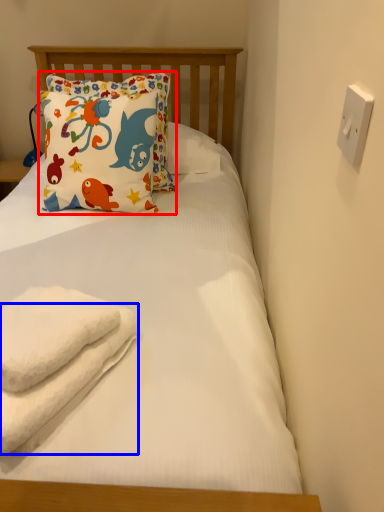
Question: Which of the following is the closest to the observer, pillow (highlighted by a red box) or beach towel (highlighted by a blue box)?

Choices:
 (A) pillow
 (B) beach towel

Answer: (B)